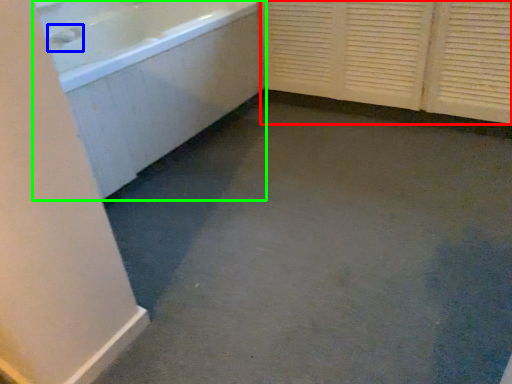
Question: Estimate the real-world distances between objects in this image. Which object is farther from screen door (highlighted by a red box), faucet (highlighted by a blue box) or bathtub (highlighted by a green box)?

Choices:
 (A) faucet
 (B) bathtub

Answer: (A)